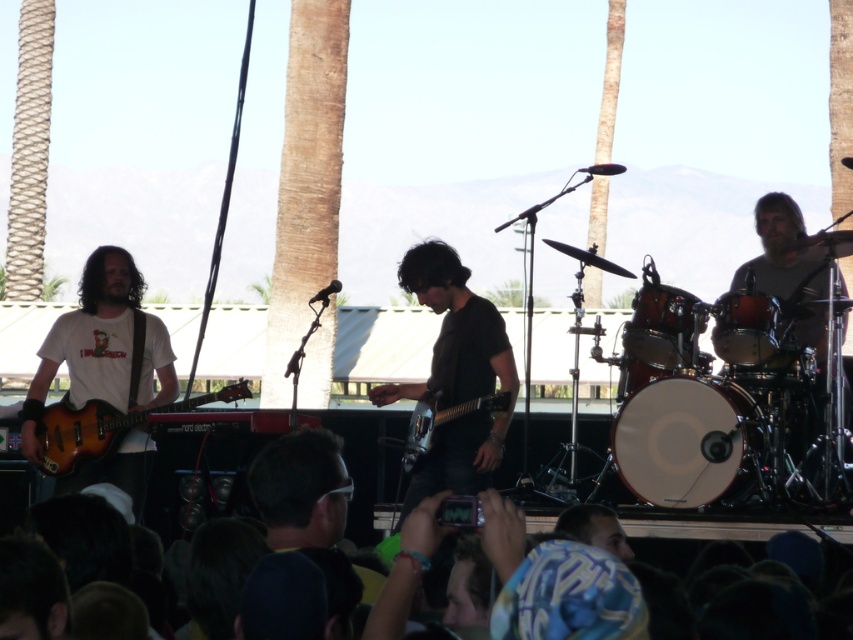
Which is in front, point (685, 346) or point (697, 372)?

Point (697, 372) is in front.

Who is taller, shiny metallic drum at center right or matte black drum at center?

With more height is shiny metallic drum at center right.

Which is behind, point (646, 356) or point (666, 368)?

The point (666, 368) is behind.

I want to click on shiny metallic drum at center right, so click(x=660, y=324).

Who is lower down, sunburst wood electric guitar at left or shiny metallic drum at center right?

Positioned lower is sunburst wood electric guitar at left.

Is sunburst wood electric guitar at left to the right of shiny metallic drum at center right from the viewer's perspective?

No, sunburst wood electric guitar at left is not to the right of shiny metallic drum at center right.

Describe the element at coordinates (103, 426) in the screenshot. This screenshot has height=640, width=853. I see `sunburst wood electric guitar at left` at that location.

What are the coordinates of `sunburst wood electric guitar at left` in the screenshot? It's located at (103, 426).

Image resolution: width=853 pixels, height=640 pixels. In order to click on white matte drum at center in this screenshot , I will do `click(688, 440)`.

Describe the element at coordinates (688, 440) in the screenshot. This screenshot has width=853, height=640. I see `white matte drum at center` at that location.

Locate an element on the screen. The height and width of the screenshot is (640, 853). white matte drum at center is located at coordinates (688, 440).